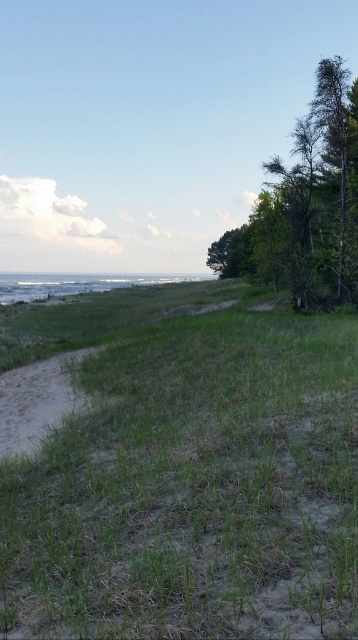
Who is positioned more to the left, green grassy at lower left or dark green leafy tree at right?

Positioned to the left is green grassy at lower left.

Does green grassy at lower left appear on the right side of dark green leafy tree at right?

In fact, green grassy at lower left is to the left of dark green leafy tree at right.

Which is behind, point (36, 582) or point (346, 248)?

The point (346, 248) is more distant.

What are the coordinates of `green grassy at lower left` in the screenshot? It's located at (180, 467).

Is dark green leafy tree at right thinner than sandy dirt path at lower left?

Incorrect, dark green leafy tree at right's width is not less than sandy dirt path at lower left's.

Who is more distant from viewer, (346,209) or (21,374)?

Point (346,209)

I want to click on dark green leafy tree at right, so click(x=306, y=205).

Based on the photo, can you confirm if green grassy at lower left is bigger than sandy dirt path at lower left?

Indeed, green grassy at lower left has a larger size compared to sandy dirt path at lower left.

Describe the element at coordinates (180, 467) in the screenshot. I see `green grassy at lower left` at that location.

This screenshot has width=358, height=640. I want to click on green grassy at lower left, so click(x=180, y=467).

Locate an element on the screen. green grassy at lower left is located at coordinates (180, 467).